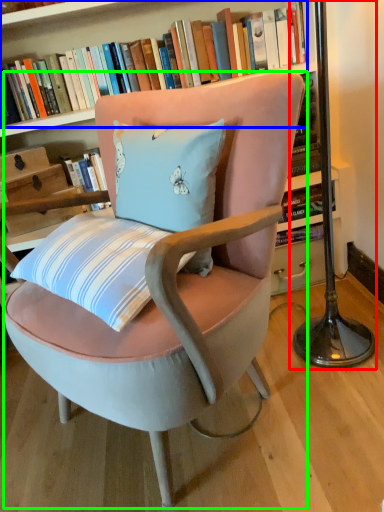
Question: Which object is positioned closest to table lamp (highlighted by a red box)? Select from book (highlighted by a blue box) and chair (highlighted by a green box).

Choices:
 (A) book
 (B) chair

Answer: (B)